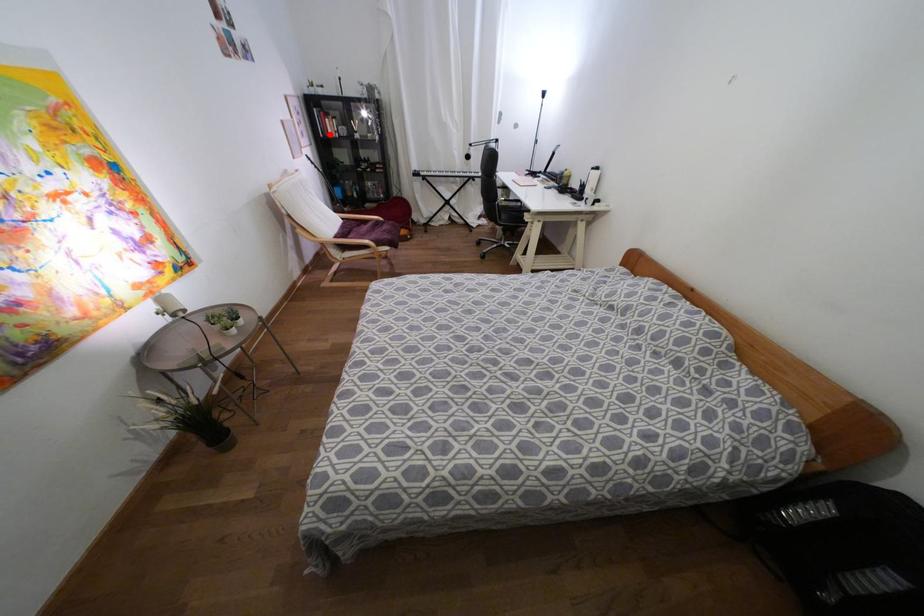
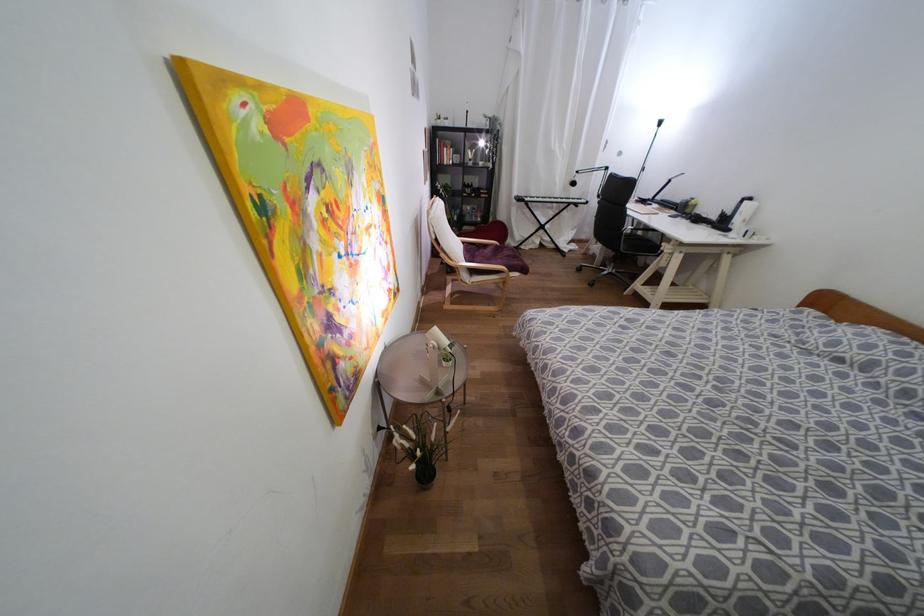
Find the pixel in the second image that matches the highlighted location in the first image.

(444, 161)